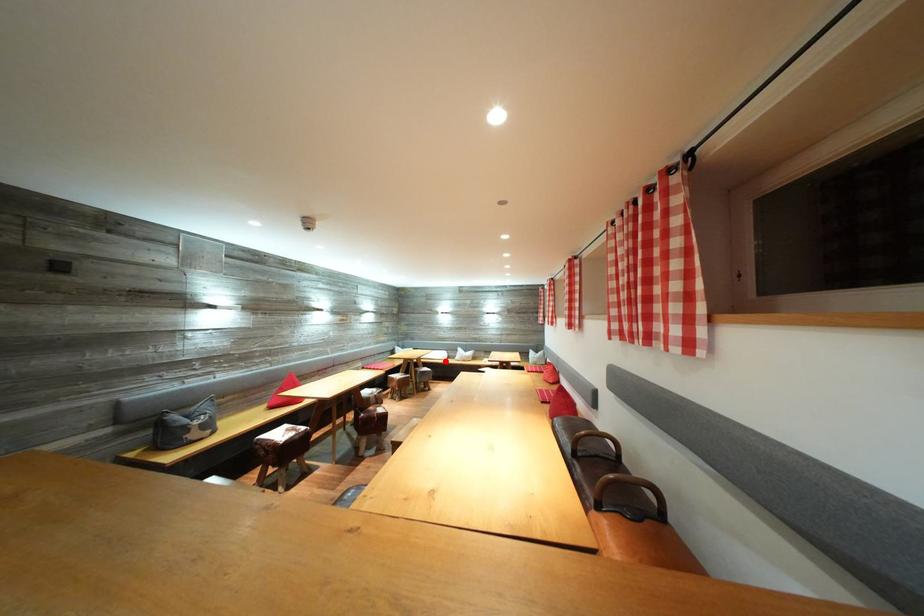
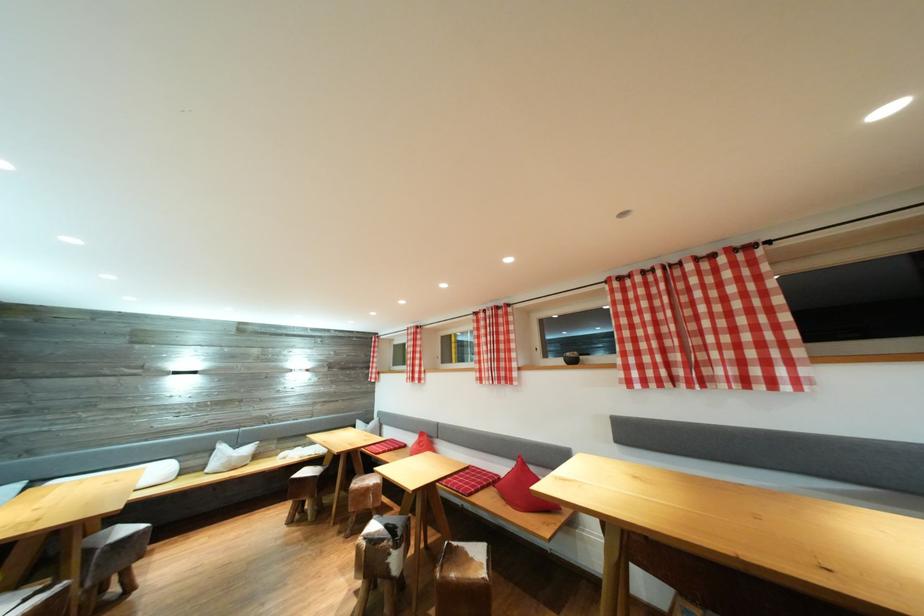
In the second image, find the point that corresponds to the highlighted location in the first image.

(161, 483)